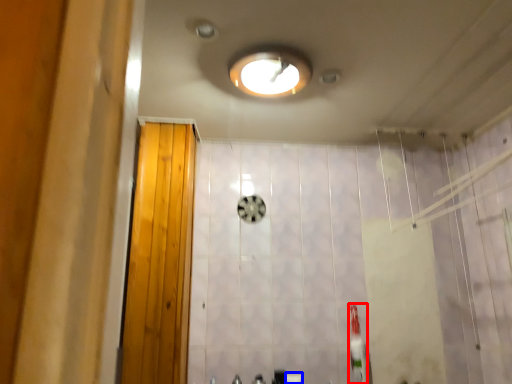
Question: Which object is further to the camera taking this photo, toothbrush (highlighted by a red box) or toilet paper (highlighted by a blue box)?

Choices:
 (A) toothbrush
 (B) toilet paper

Answer: (B)